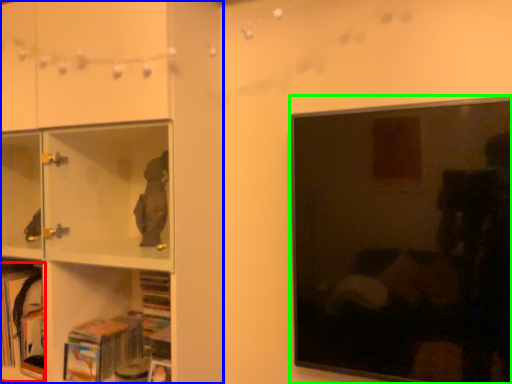
Question: Which object is positioned farthest from book (highlighted by a red box)? Select from shelf (highlighted by a blue box) and picture frame (highlighted by a green box).

Choices:
 (A) shelf
 (B) picture frame

Answer: (B)